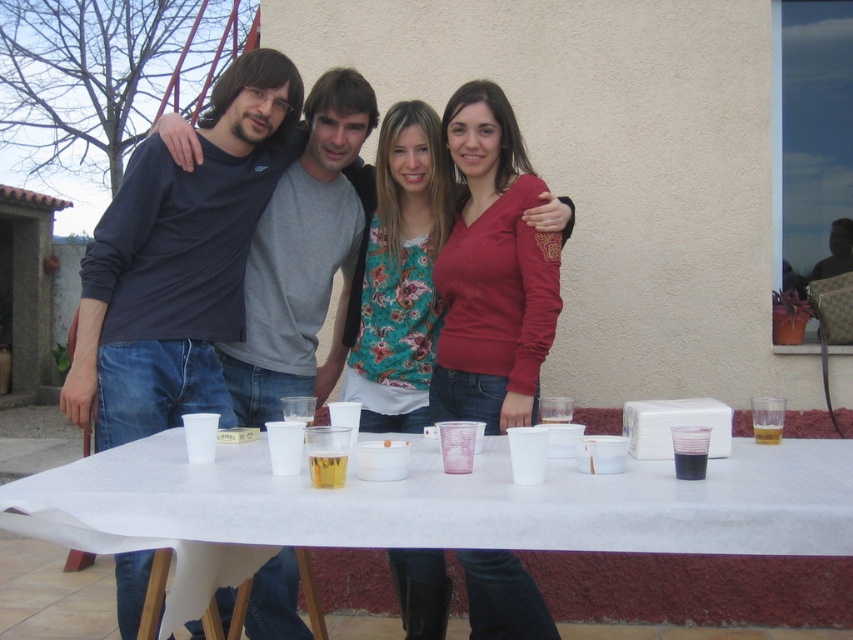
The width and height of the screenshot is (853, 640). What do you see at coordinates (178, 260) in the screenshot?
I see `matte black shirt at left` at bounding box center [178, 260].

Who is positioned more to the left, matte black shirt at left or floral fabric shirt at center?

Positioned to the left is matte black shirt at left.

Who is more forward, (148,272) or (525,611)?

Point (525,611) is in front.

Locate an element on the screen. The image size is (853, 640). matte black shirt at left is located at coordinates (178, 260).

Is the position of matte black shirt at left less distant than that of dark blue shirt at left?

Yes, matte black shirt at left is closer to the viewer.

Which is more to the right, matte black shirt at left or dark blue shirt at left?

dark blue shirt at left

Is point (155, 344) less distant than point (328, 244)?

Yes, point (155, 344) is in front of point (328, 244).

Where is `matte black shirt at left`? The width and height of the screenshot is (853, 640). matte black shirt at left is located at coordinates (178, 260).

Measure the distance from matte black shirt at left to translucent glass beer at table center.

The distance of matte black shirt at left from translucent glass beer at table center is 6.16 feet.

Is matte black shirt at left positioned before translucent glass beer at table center?

No, matte black shirt at left is behind translucent glass beer at table center.

I want to click on matte black shirt at left, so click(178, 260).